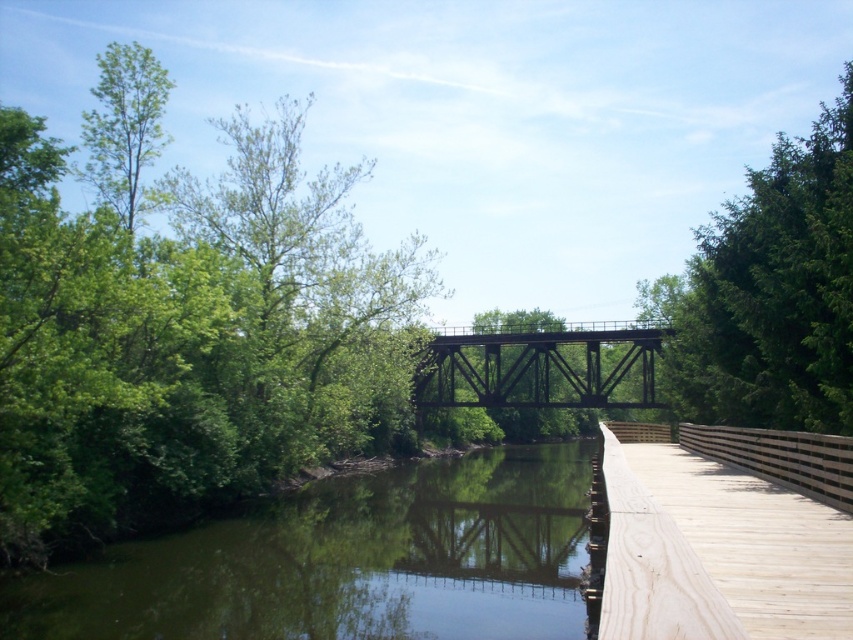
Question: Can you confirm if green leafy tree at left is positioned to the right of green reflective water at lower center?

Choices:
 (A) no
 (B) yes

Answer: (A)

Question: Which is farther from the green matte bridge at center?

Choices:
 (A) green reflective water at lower center
 (B) green leafy tree at left
 (C) green leafy tree at upper right

Answer: (A)

Question: Does green leafy tree at left come in front of green leafy tree at upper right?

Choices:
 (A) yes
 (B) no

Answer: (B)

Question: In this image, where is green reflective water at lower center located relative to green matte bridge at center?

Choices:
 (A) above
 (B) below

Answer: (B)

Question: Which point is farther to the camera?

Choices:
 (A) green reflective water at lower center
 (B) green leafy tree at upper right
 (C) green matte bridge at center

Answer: (C)

Question: Among these objects, which one is farthest from the camera?

Choices:
 (A) green reflective water at lower center
 (B) green leafy tree at left

Answer: (B)